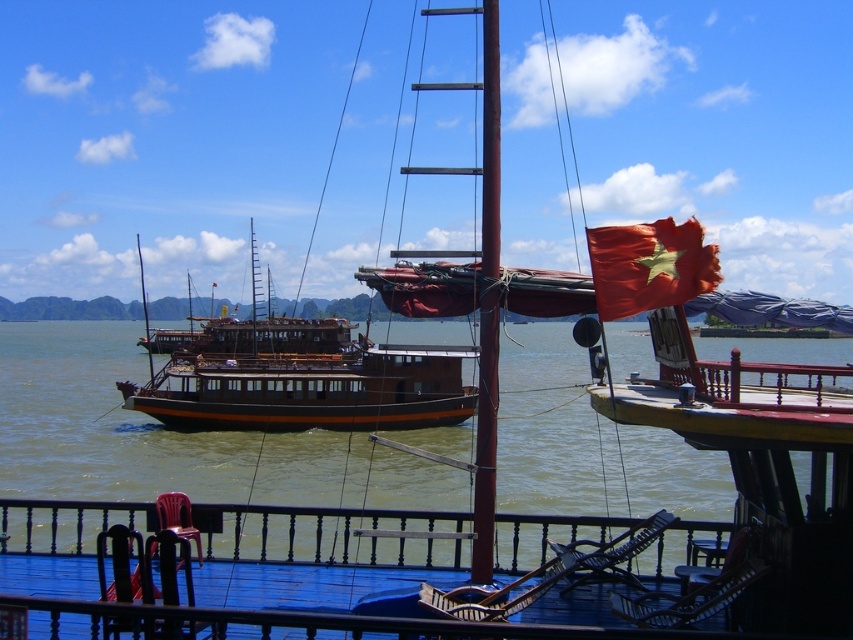
Question: Which object is the closest to the brown wooden boat at center?

Choices:
 (A) red matte flag at upper right
 (B) greenish water at center

Answer: (B)

Question: Can you confirm if greenish water at center is positioned to the right of brown wooden boat at center?

Choices:
 (A) yes
 (B) no

Answer: (A)

Question: Estimate the real-world distances between objects in this image. Which object is closer to the brown wooden boat at center?

Choices:
 (A) red matte flag at upper right
 (B) greenish water at center

Answer: (B)

Question: Can you confirm if greenish water at center is positioned to the left of brown wooden boat at center?

Choices:
 (A) yes
 (B) no

Answer: (B)

Question: Among these points, which one is farthest from the camera?

Choices:
 (A) (665, 225)
 (B) (303, 337)

Answer: (B)

Question: Observing the image, what is the correct spatial positioning of greenish water at center in reference to brown wooden boat at center?

Choices:
 (A) left
 (B) right

Answer: (B)